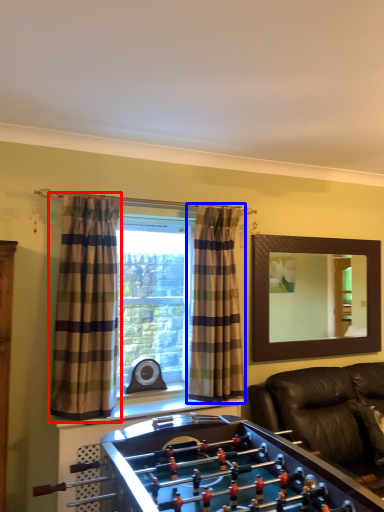
Question: Which object appears farthest to the camera in this image, curtain (highlighted by a red box) or curtain (highlighted by a blue box)?

Choices:
 (A) curtain
 (B) curtain

Answer: (B)